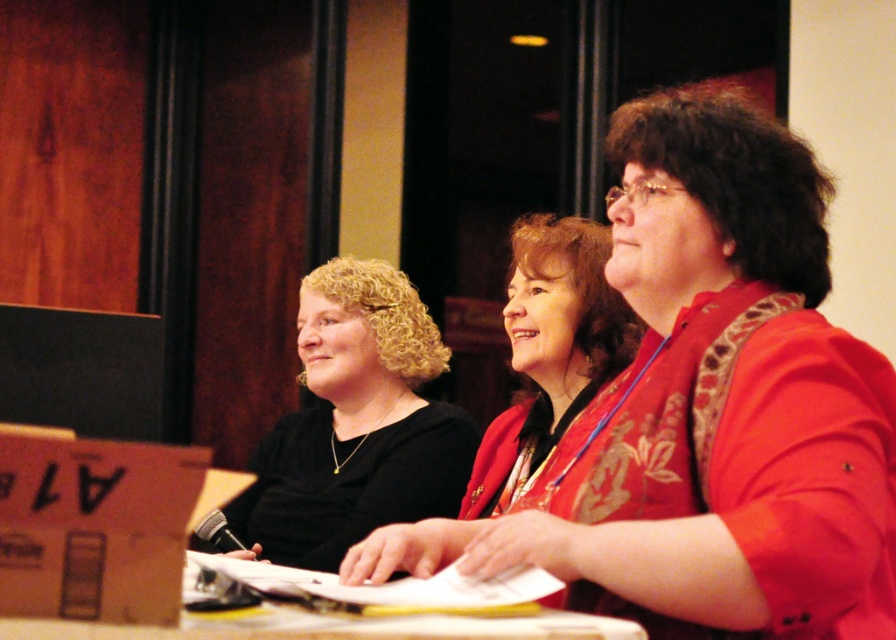
You are organizing a photo shoot and need to ensure that all clothing items in the image are visible. Given that the matte red blouse at center and the black matte shirt at center are both in focus, which one might require adjustment to ensure it doesn not get lost in the composition?

The matte red blouse at center is smaller than the black matte shirt at center, so it might require adjustment to ensure it doesn not get lost in the composition.

You are organizing a photo shoot and need to place a 10cm wide decorative item on the table. The item must be placed between the matte red jacket at center and the white glossy table at lower center. Is there enough space between them for the item?

The matte red jacket at center is thinner than the white glossy table at lower center. However, the description only mentions their relative thickness, not the distance between them. Without knowing the exact distance between the two objects, it is impossible to determine if the 10cm wide decorative item will fit.